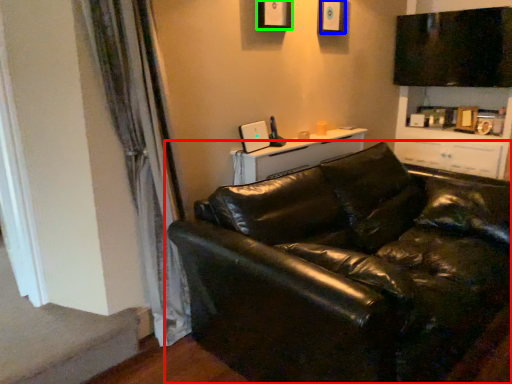
Question: Estimate the real-world distances between objects in this image. Which object is closer to studio couch (highlighted by a red box), picture frame (highlighted by a blue box) or picture frame (highlighted by a green box)?

Choices:
 (A) picture frame
 (B) picture frame

Answer: (B)